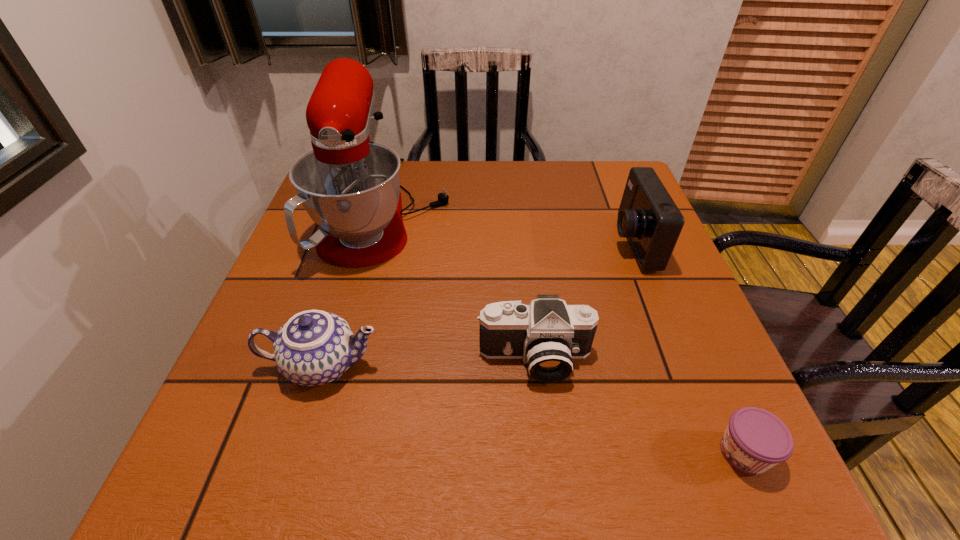
Where is `mixer`? mixer is located at coordinates (350, 187).

At what (x,y) coordinates should I click in order to perform the action: click on the right camera. Please return your answer as a coordinate pair (x, y). Image resolution: width=960 pixels, height=540 pixels. Looking at the image, I should click on (649, 218).

You are a GUI agent. You are given a task and a screenshot of the screen. Output one action in this format:
    pyautogui.click(x=<x>, y=<y>)
    Task: Click on the left camera
    Image resolution: width=960 pixels, height=540 pixels.
    Given the screenshot: What is the action you would take?
    pyautogui.click(x=548, y=334)

Identify the location of the third object from right to left. (x=548, y=334).

Identify the location of chinaware. (314, 347).

Where is `the nearest object`? the nearest object is located at coordinates (755, 440).

Find the location of a particular element. The height and width of the screenshot is (540, 960). jam is located at coordinates pos(755,440).

The height and width of the screenshot is (540, 960). Find the location of `free space located 0.150m on the bowl side of the mixer`. free space located 0.150m on the bowl side of the mixer is located at coordinates (507, 210).

Locate an element on the screen. The width and height of the screenshot is (960, 540). free region located 0.100m on the front-facing side of the right camera is located at coordinates (569, 243).

Identify the location of free location located on the front-facing side of the right camera. The height and width of the screenshot is (540, 960). (492, 243).